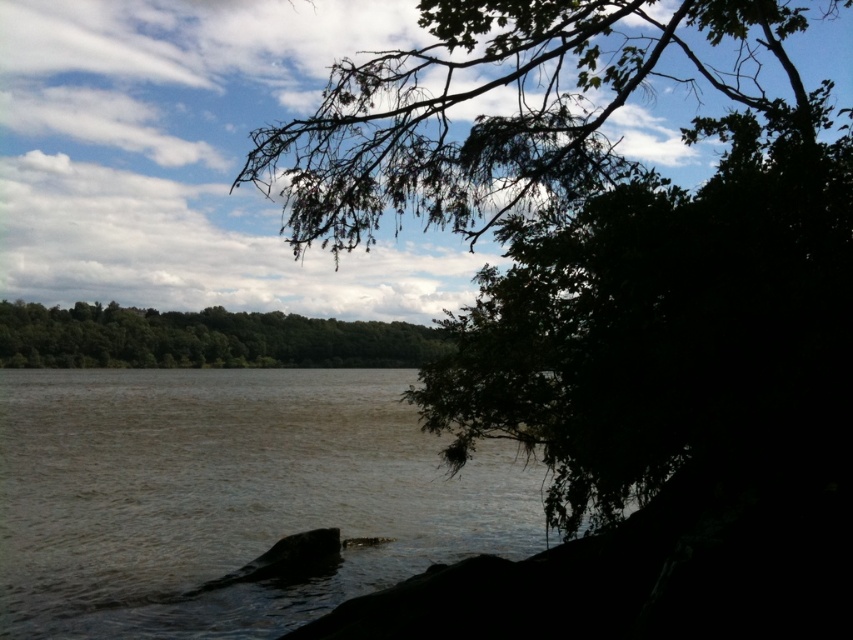
You are an environmental scientist assessing the river. You observe the brown murky water at center and the green leafy branch at upper center. Which object occupies a larger horizontal space in the image?

The brown murky water at center might be wider than green leafy branch at upper center, so it likely occupies a larger horizontal space in the image.

Looking at this image, you are an ornithologist observing the riverside scene. You notice the green leafy branch at upper center and the green leafy trees at center. Which object is closer to the observer?

The green leafy branch at upper center is closer to the observer because it is positioned over the green leafy trees at center, indicating it is in a nearer plane of the scene.

You are an artist sketching the riverside scene. You need to decide which object to draw first based on their size. Which should you start with, the green leafy branch at upper center or the green leafy trees at center?

The green leafy branch at upper center is larger in size than the green leafy trees at center, so you should start with the green leafy branch at upper center.